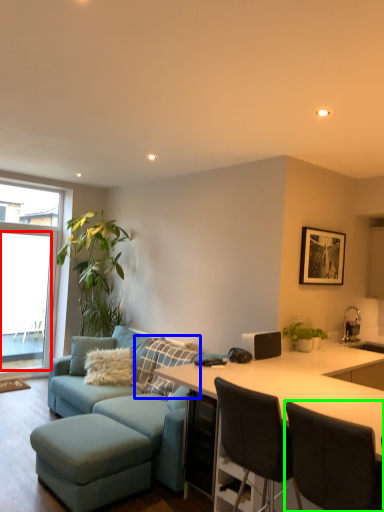
Question: Which is nearer to the window screen (highlighted by a red box)? pillow (highlighted by a blue box) or chair (highlighted by a green box).

Choices:
 (A) pillow
 (B) chair

Answer: (A)